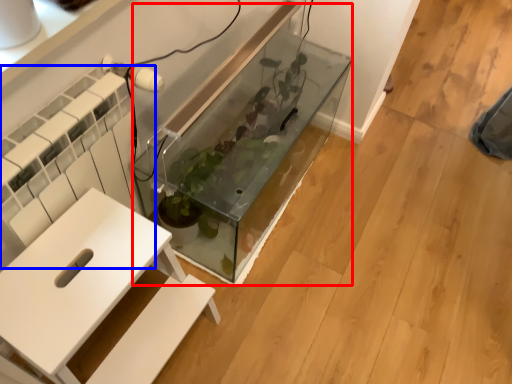
Question: Which point is closer to the camera, glass box (highlighted by a red box) or radiator (highlighted by a blue box)?

Choices:
 (A) glass box
 (B) radiator

Answer: (B)